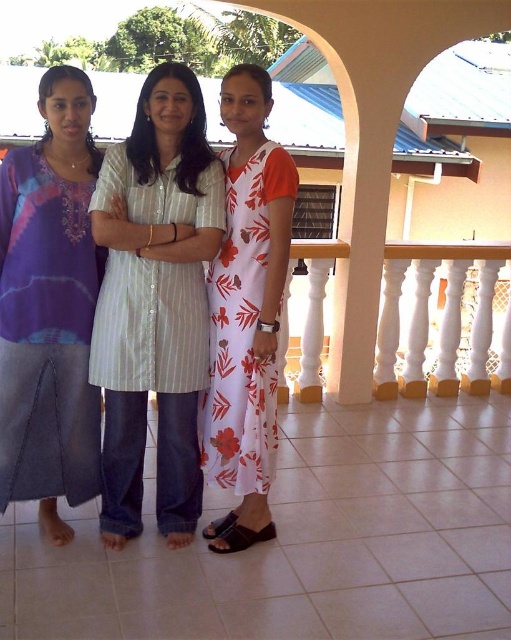
You are on the balcony and want to move from point A to point B. The coordinates for point A are at (x=52, y=392) and point B are at (x=278, y=198). Which point is closer to the building with the blue roof?

Point B at (x=278, y=198) is closer to the building with the blue roof because the description states that point A at (x=52, y=392) is behind point B, implying it is farther away from the building.